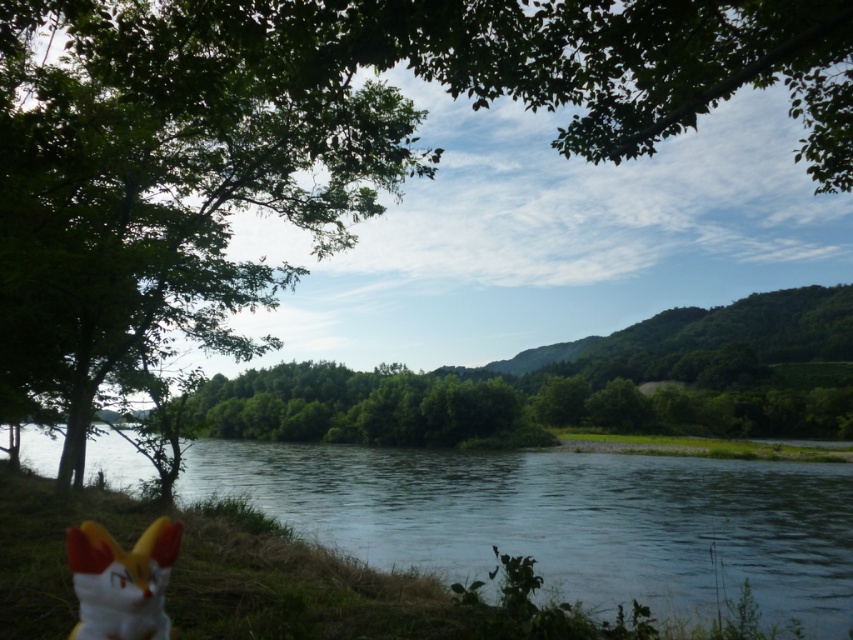
Question: Which object appears closest to the camera in this image?

Choices:
 (A) white matte plush toy at lower left
 (B) clear water at center

Answer: (A)

Question: Which point is farther to the camera?

Choices:
 (A) white matte plush toy at lower left
 (B) clear water at center

Answer: (B)

Question: In this image, where is clear water at center located relative to white matte plush toy at lower left?

Choices:
 (A) above
 (B) below

Answer: (B)

Question: Can you confirm if clear water at center is bigger than white matte plush toy at lower left?

Choices:
 (A) yes
 (B) no

Answer: (A)

Question: Can you confirm if clear water at center is positioned below white matte plush toy at lower left?

Choices:
 (A) yes
 (B) no

Answer: (A)